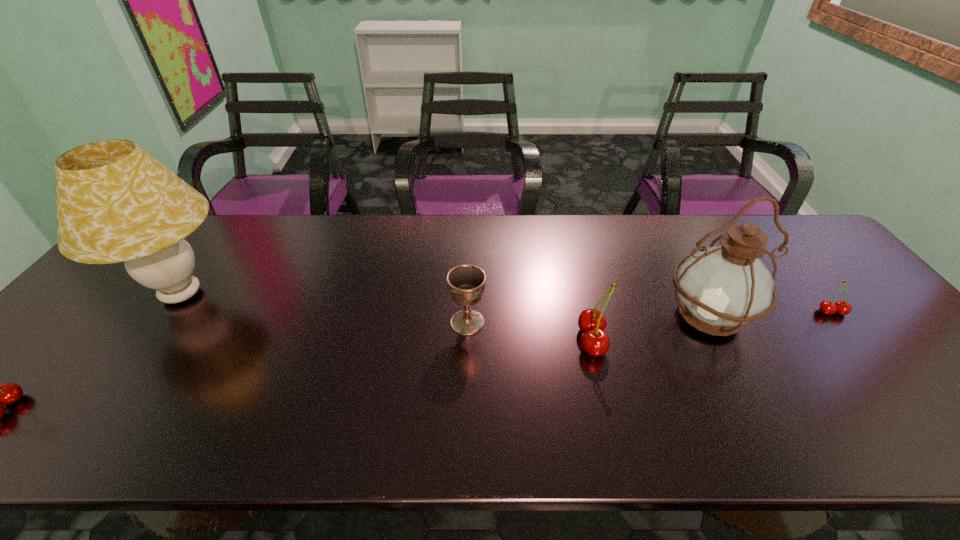
Where is `free area in between the chalice and the rightmost cherry`? This screenshot has height=540, width=960. free area in between the chalice and the rightmost cherry is located at coordinates (650, 318).

You are a GUI agent. You are given a task and a screenshot of the screen. Output one action in this format:
    pyautogui.click(x=<x>, y=<y>)
    Task: Click on the vacant space that is in between the third object from left to right and the lampshade
    This screenshot has width=960, height=540.
    Given the screenshot: What is the action you would take?
    pyautogui.click(x=324, y=308)

At what (x,y) coordinates should I click in order to perform the action: click on empty location between the lampshade and the chalice. Please return your answer as a coordinate pair (x, y). The width and height of the screenshot is (960, 540). Looking at the image, I should click on 324,308.

In order to click on empty location between the rightmost object and the fifth object from right to left in this screenshot , I will do `click(507, 303)`.

Locate an element on the screen. vacant region between the fourth object from right to left and the second object from left to right is located at coordinates pyautogui.click(x=324, y=308).

Locate an element on the screen. empty location between the oil lamp and the lampshade is located at coordinates (444, 305).

Locate which object ranks second in proximity to the fifth object from left to right. Please provide its 2D coordinates. Your answer should be formatted as a tuple, i.e. [(x, y)], where the tuple contains the x and y coordinates of a point satisfying the conditions above.

[(826, 307)]

Locate an element on the screen. This screenshot has height=540, width=960. the third closest object relative to the nearest object is located at coordinates (595, 341).

Where is `cherry that is the third closest one to the fourth object from right to left`? cherry that is the third closest one to the fourth object from right to left is located at coordinates (5, 394).

Where is `the closest cherry to the lampshade`? the closest cherry to the lampshade is located at coordinates (5, 394).